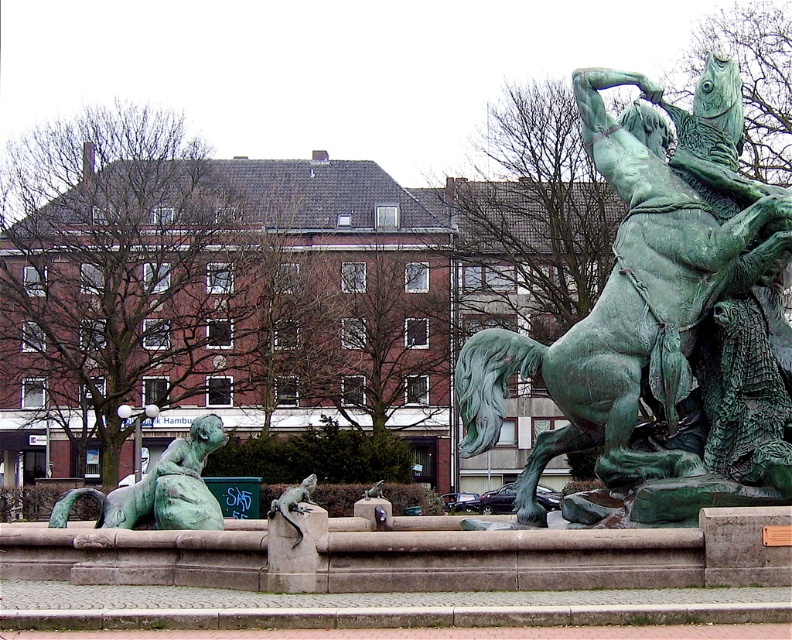
Which is in front, point (722, 308) or point (181, 477)?

Point (722, 308) is more forward.

Is the position of green patina horse at center more distant than that of green patina statue at lower left?

No, it is in front of green patina statue at lower left.

Which is in front, point (676, 244) or point (58, 524)?

Point (676, 244)

Identify the location of green patina horse at center. (663, 323).